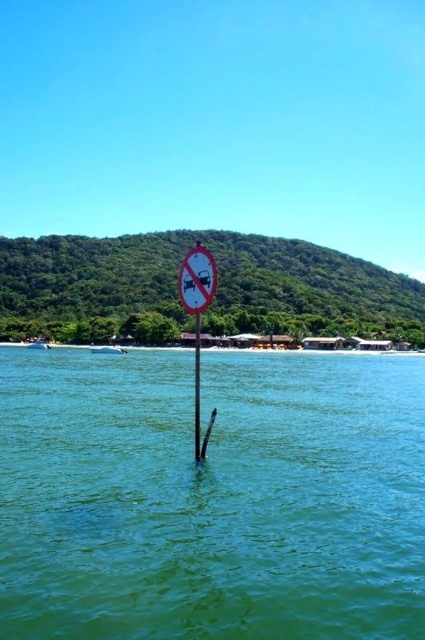
Question: Which point appears closest to the camera in this image?

Choices:
 (A) (195, 436)
 (B) (36, 445)

Answer: (A)

Question: Can you confirm if green water at center is wider than smooth wood pole at center?

Choices:
 (A) no
 (B) yes

Answer: (B)

Question: Is green water at center bigger than smooth wood pole at center?

Choices:
 (A) yes
 (B) no

Answer: (B)

Question: Does green water at center appear on the right side of smooth wood pole at center?

Choices:
 (A) no
 (B) yes

Answer: (B)

Question: Which object is farther from the camera taking this photo?

Choices:
 (A) green water at center
 (B) smooth wood pole at center

Answer: (B)

Question: Among these objects, which one is nearest to the camera?

Choices:
 (A) green water at center
 (B) smooth wood pole at center

Answer: (A)